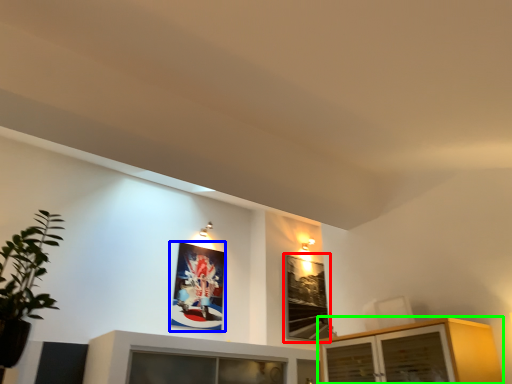
Question: Which object is the farthest from picture frame (highlighted by a red box)? Choose among these: picture frame (highlighted by a blue box) or cabinetry (highlighted by a green box).

Choices:
 (A) picture frame
 (B) cabinetry

Answer: (B)